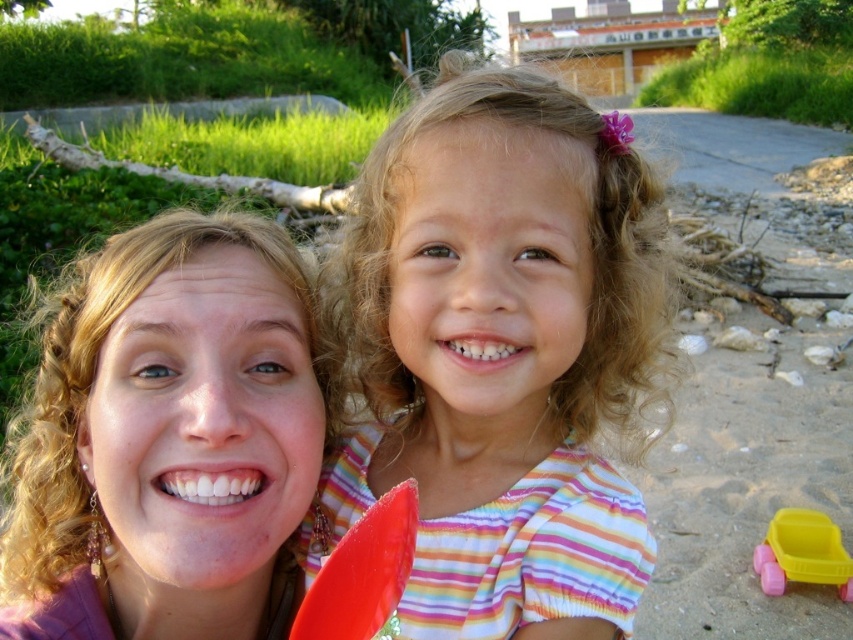
You are a photographer trying to capture a candid shot of the two people in the scene. You want to ensure that both the matte purple shirt at center and the yellow plastic toy car at lower right are clearly visible in the frame. Based on their positions, which object should you position closer to the center of your camera viewfinder to include both subjects without cropping either?

Since the matte purple shirt at center is to the left of the yellow plastic toy car at lower right, positioning the yellow plastic toy car at lower right closer to the center of the camera viewfinder would help include both subjects without cropping either, as it is already positioned further to the right.

You are a photographer trying to capture a photo of both the matte striped shirt at center and the yellow plastic toy car at lower right. Since you want both subjects to appear equally large in the photo, which object should you move closer to the camera?

The yellow plastic toy car at lower right should be moved closer to the camera because it is shorter than the matte striped shirt at center. By moving it closer, its image size in the photo will increase to match the size of the taller shirt.